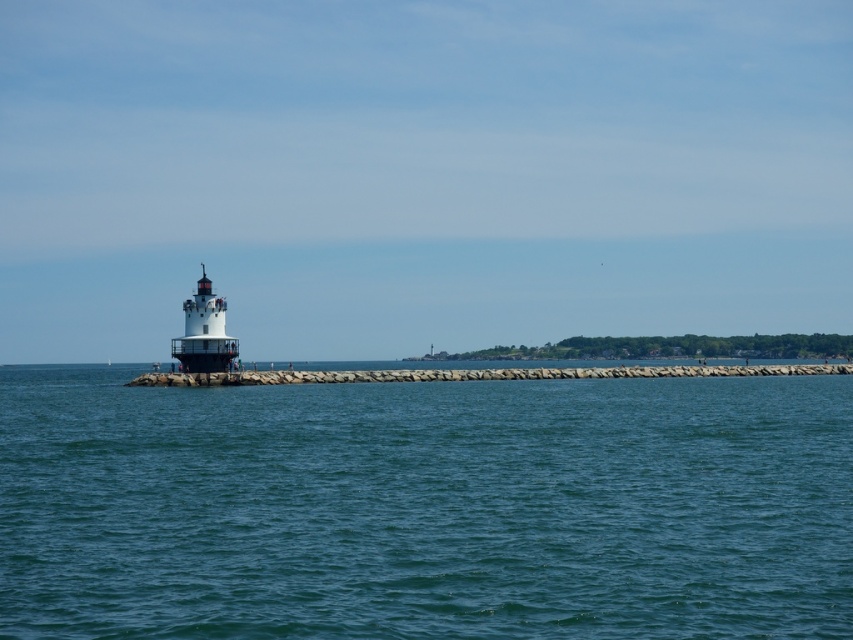
Which of these two, blue water at center or white painted metal lighthouse at left, stands taller?

Standing taller between the two is blue water at center.

I want to click on blue water at center, so click(424, 508).

Who is more distant from viewer, (311, 576) or (171, 353)?

Point (171, 353)

Identify the location of blue water at center. The image size is (853, 640). (424, 508).

Which is more to the left, blue water at center or smooth concrete wall at center?

From the viewer's perspective, blue water at center appears more on the left side.

Does point (292, 474) come behind point (173, 385)?

No, (292, 474) is closer to viewer.

Image resolution: width=853 pixels, height=640 pixels. I want to click on blue water at center, so click(424, 508).

Does smooth concrete wall at center appear on the left side of white painted metal lighthouse at left?

No, smooth concrete wall at center is not to the left of white painted metal lighthouse at left.

Can you confirm if smooth concrete wall at center is thinner than white painted metal lighthouse at left?

No, smooth concrete wall at center is not thinner than white painted metal lighthouse at left.

Who is more distant from viewer, (x=149, y=380) or (x=209, y=288)?

The point (x=209, y=288) is behind.

Identify the location of smooth concrete wall at center. The image size is (853, 640). (474, 374).